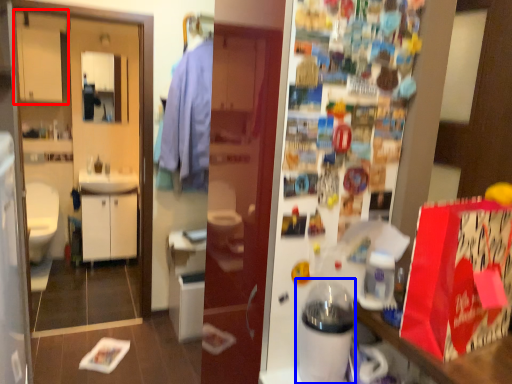
Question: Among these objects, which one is farthest to the camera, cabinetry (highlighted by a red box) or appliance (highlighted by a blue box)?

Choices:
 (A) cabinetry
 (B) appliance

Answer: (A)